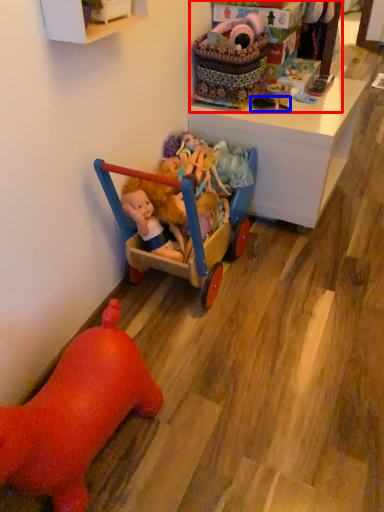
Question: Which object appears closest to the camera in this image, toyshop (highlighted by a red box) or toy (highlighted by a blue box)?

Choices:
 (A) toyshop
 (B) toy

Answer: (A)